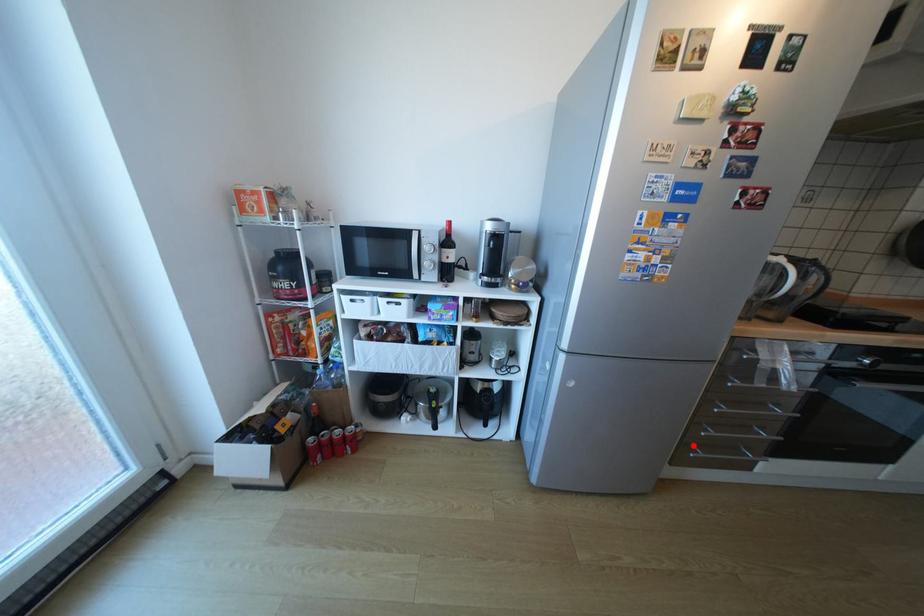
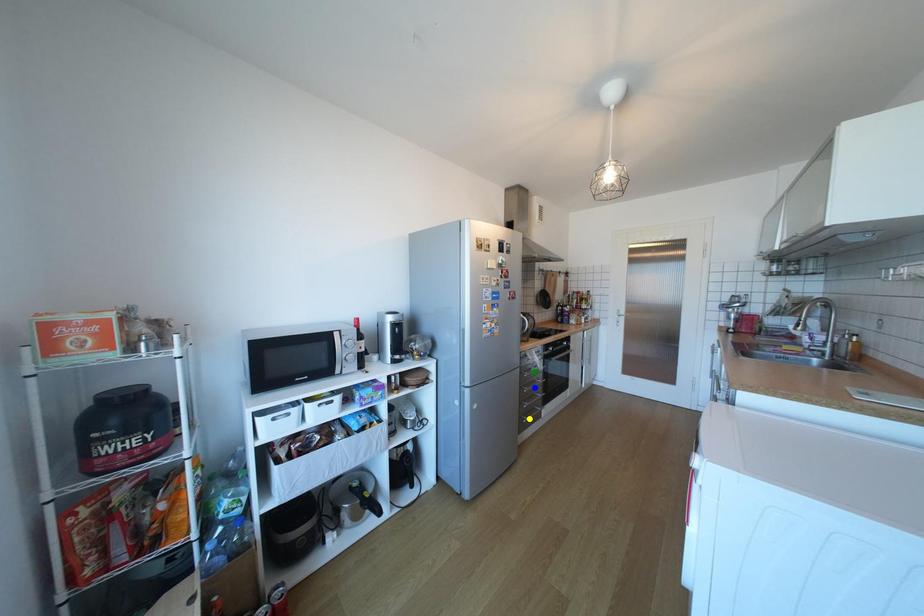
Question: I am providing you with two images of the same scene from different viewpoints. A red point is marked on the first image. You are given multiple points on the second image. In image 2, which mark is for the same physical point as the one in image 1?

Choices:
 (A) green point
 (B) yellow point
 (C) blue point

Answer: (B)